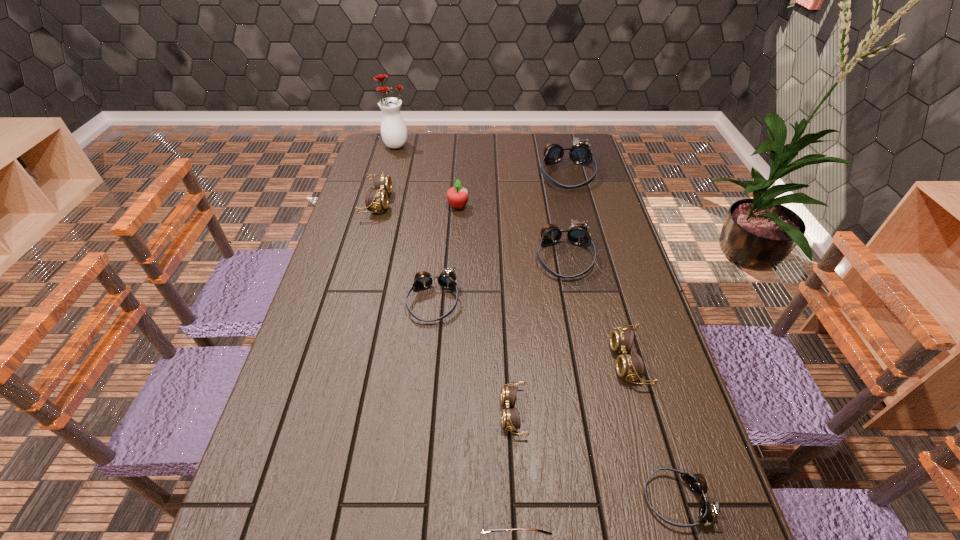
This screenshot has height=540, width=960. Find the location of `the third closest bronze goggles to the rightmost brown goggles`. the third closest bronze goggles to the rightmost brown goggles is located at coordinates (447, 279).

Locate which brown goggles ranks in proximity to the second nearest object. Please provide its 2D coordinates. Your answer should be formatted as a tuple, i.e. [(x, y)], where the tuple contains the x and y coordinates of a point satisfying the conditions above.

[(631, 366)]

Point out which brown goggles is positioned as the second nearest to the red vase. Please provide its 2D coordinates. Your answer should be formatted as a tuple, i.e. [(x, y)], where the tuple contains the x and y coordinates of a point satisfying the conditions above.

[(631, 366)]

Image resolution: width=960 pixels, height=540 pixels. Identify the location of vacant point that satisfies the following two spatial constraints: 1. through the lenses of the farthest bronze goggles; 2. through the lenses of the fifth goggles from right to left. (627, 413).